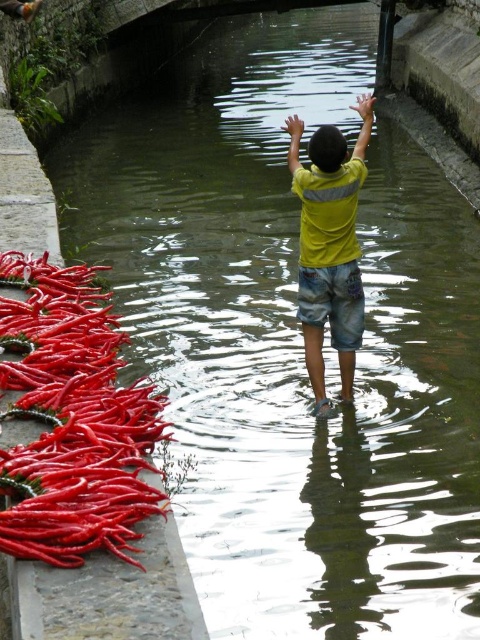
Question: From the image, what is the correct spatial relationship of bright red chili peppers at left in relation to yellow matte shirt at center?

Choices:
 (A) right
 (B) left

Answer: (B)

Question: Among these points, which one is farthest from the camera?

Choices:
 (A) (2, 458)
 (B) (372, 99)

Answer: (B)

Question: Can you confirm if bright red chili peppers at left is wider than yellow matte shirt at center?

Choices:
 (A) no
 (B) yes

Answer: (A)

Question: Which object appears farthest from the camera in this image?

Choices:
 (A) yellow matte shirt at center
 (B) bright red chili peppers at left

Answer: (A)

Question: Is bright red chili peppers at left behind yellow matte shirt at center?

Choices:
 (A) yes
 (B) no

Answer: (B)